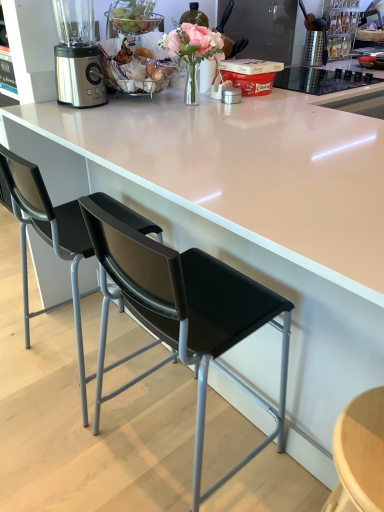
Question: Considering their positions, is black plastic chair at left, arranged as the 2th chair when viewed from the right, located in front of or behind satin silver blender at upper left?

Choices:
 (A) behind
 (B) front

Answer: (B)

Question: Is point (132, 211) positioned closer to the camera than point (91, 41)?

Choices:
 (A) farther
 (B) closer

Answer: (B)

Question: Which object is the closest to the black leather chair at center, the 1th chair from the right?

Choices:
 (A) satin silver blender at upper left
 (B) metallic grater at upper right
 (C) black plastic chair at left, arranged as the 2th chair when viewed from the right

Answer: (C)

Question: Which object is positioned closest to the satin silver blender at upper left?

Choices:
 (A) black plastic chair at left, arranged as the 2th chair when viewed from the right
 (B) metallic grater at upper right
 (C) black leather chair at center, the 1th chair from the right

Answer: (A)